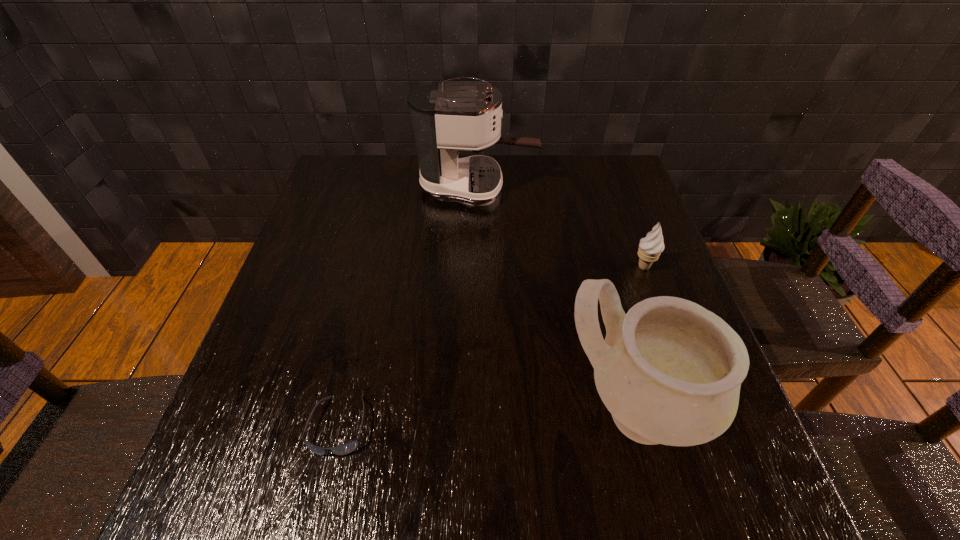
The width and height of the screenshot is (960, 540). I want to click on the farthest object, so click(446, 117).

Locate an element on the screen. pottery is located at coordinates (669, 371).

What are the coordinates of `the third nearest object` in the screenshot? It's located at (650, 247).

The image size is (960, 540). In order to click on the third tallest object in this screenshot , I will do coord(650,247).

This screenshot has width=960, height=540. I want to click on the leftmost object, so point(346,448).

Where is `the shortest object`? the shortest object is located at coordinates (346, 448).

The image size is (960, 540). In order to click on free spot located on the front-facing side of the coffee maker in this screenshot , I will do `click(553, 187)`.

Image resolution: width=960 pixels, height=540 pixels. Find the location of `vacant space located on the left of the pottery`. vacant space located on the left of the pottery is located at coordinates (526, 412).

Identify the location of vacant space located 0.380m on the front-facing side of the second shortest object. (476, 267).

Locate an element on the screen. free space located on the front-facing side of the second shortest object is located at coordinates click(x=579, y=267).